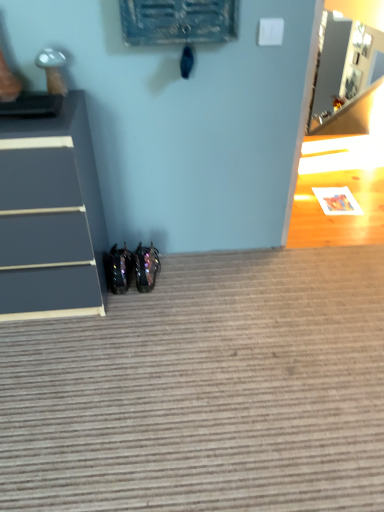
You are a GUI agent. You are given a task and a screenshot of the screen. Output one action in this format:
    pyautogui.click(x=<x>, y=<y>)
    Task: Click on the vacant space to the right of glossy metallic shoes at lower center, the 2th footwear in the left-to-right sequence
    This screenshot has width=384, height=512.
    Given the screenshot: What is the action you would take?
    pyautogui.click(x=185, y=272)